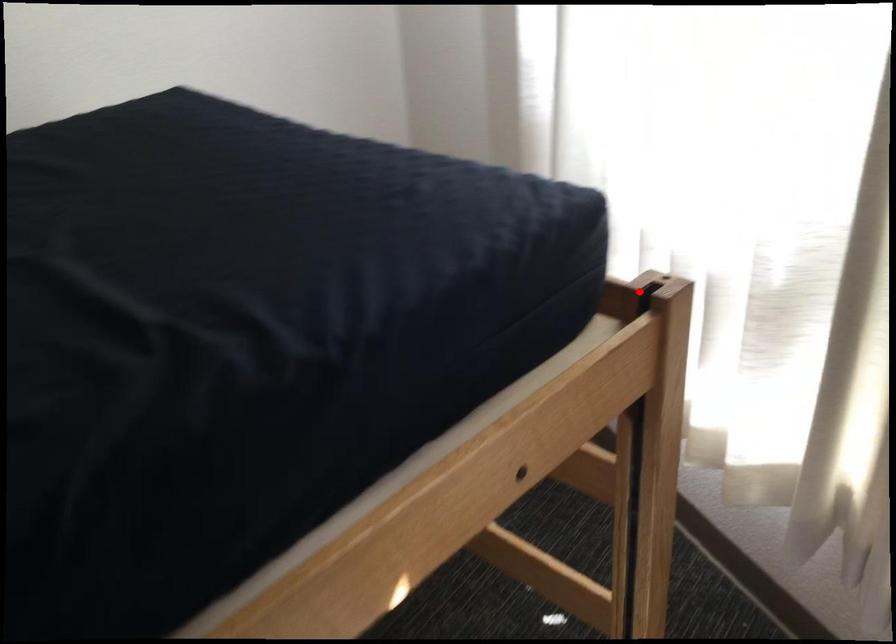
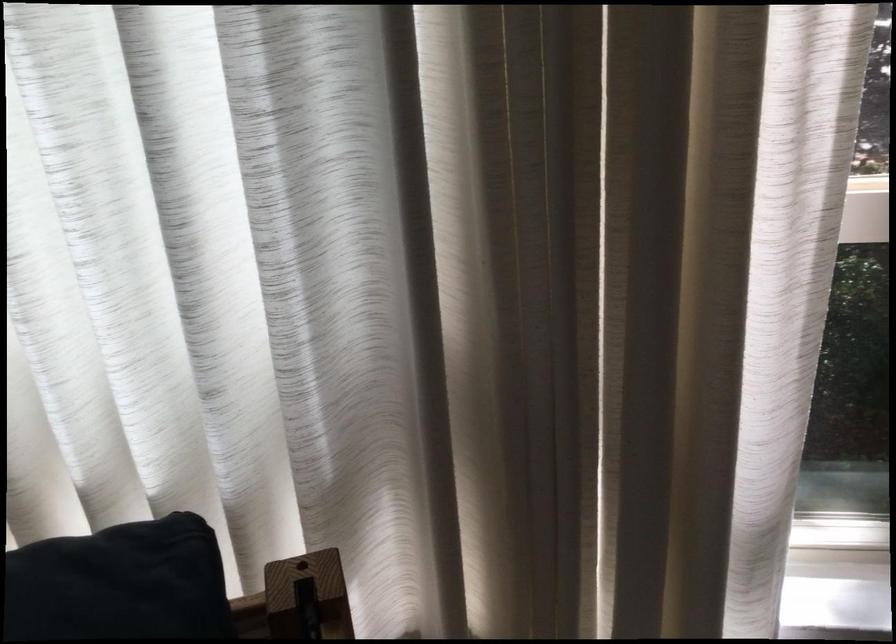
Locate, in the second image, the point that corresponds to the highlighted location in the first image.

(307, 594)